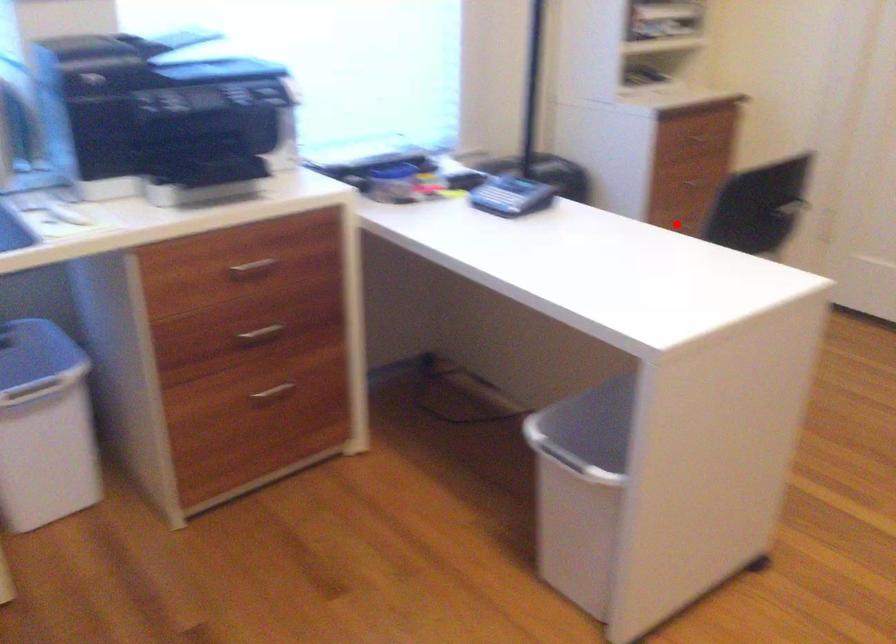
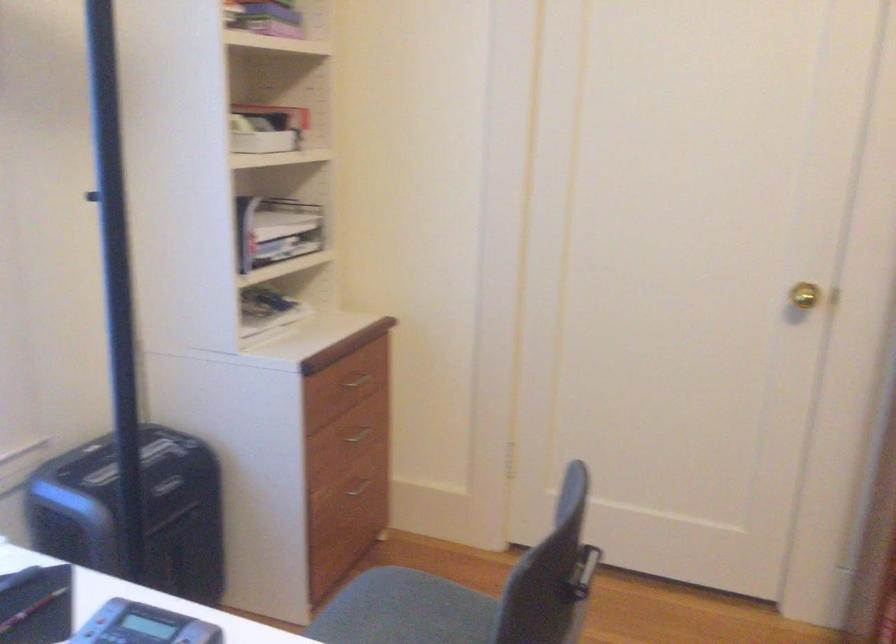
Question: I am providing you with two images of the same scene from different viewpoints. Image1 has a red point marked. In image2, the corresponding 3D location appears at what relative position? Reply with the corresponding letter.

Choices:
 (A) Closer
 (B) Farther

Answer: (A)